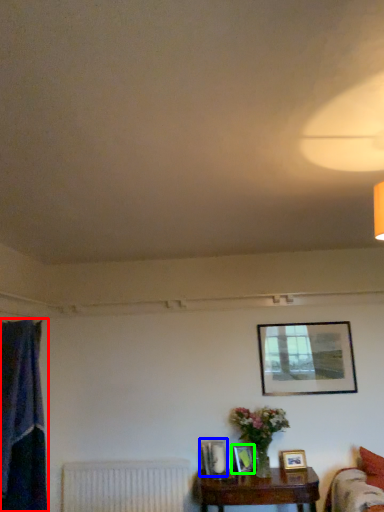
Question: Considering the real-world distances, which object is farthest from curtain (highlighted by a red box)? picture frame (highlighted by a blue box) or picture frame (highlighted by a green box)?

Choices:
 (A) picture frame
 (B) picture frame

Answer: (B)